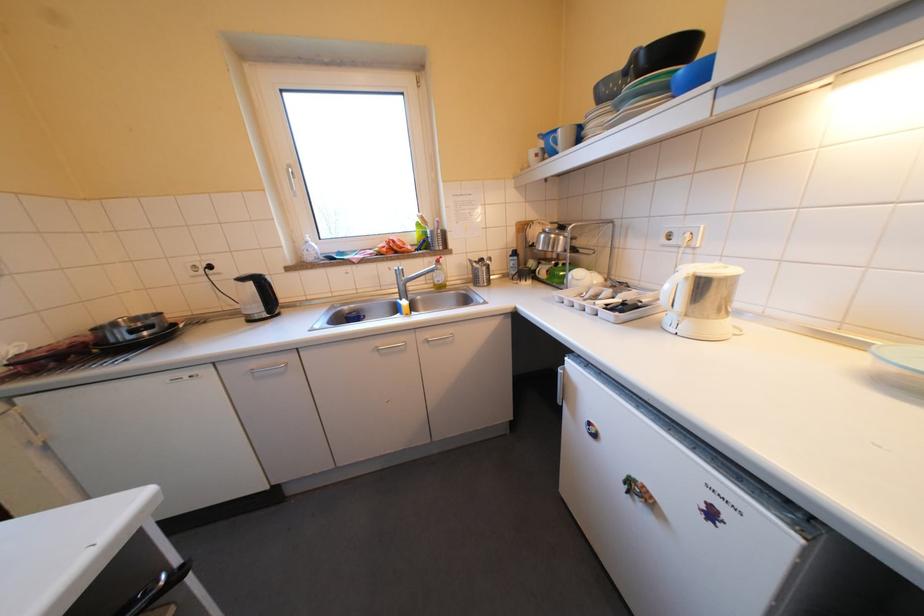
Find where to lift the blue mug handle. Please return your answer as a coordinate pair (x, y).

(541, 136)